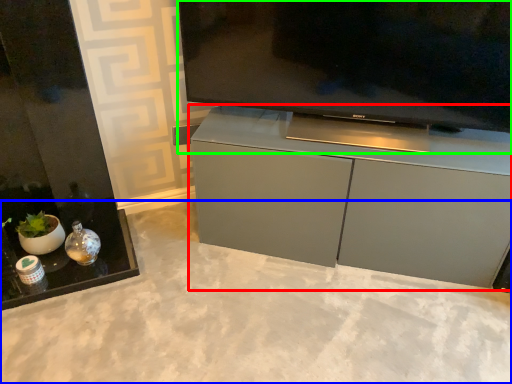
Question: Which object is the closest to the cabinetry (highlighted by a red box)? Choose among these: concrete (highlighted by a blue box) or television (highlighted by a green box).

Choices:
 (A) concrete
 (B) television

Answer: (B)